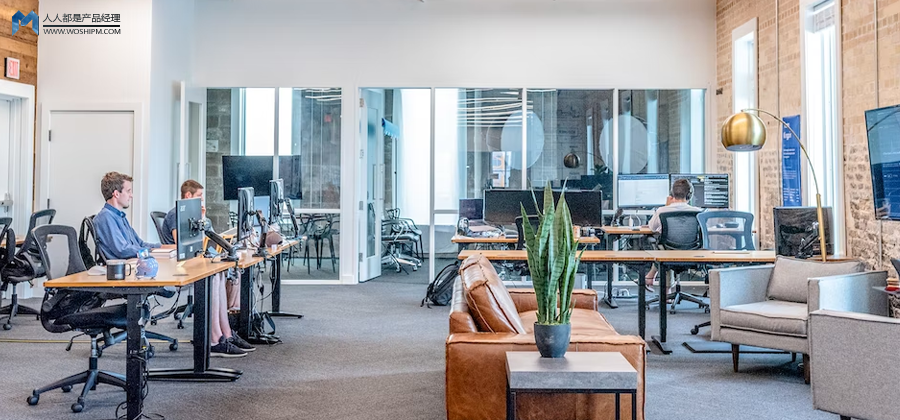
You are a GUI agent. You are given a task and a screenshot of the screen. Output one action in this format:
    pyautogui.click(x=<x>, y=<y>)
    Task: Click on the window
    This screenshot has height=420, width=900.
    Given the screenshot: What is the action you would take?
    pyautogui.click(x=258, y=127), pyautogui.click(x=412, y=136), pyautogui.click(x=740, y=90), pyautogui.click(x=828, y=92), pyautogui.click(x=694, y=150), pyautogui.click(x=653, y=121), pyautogui.click(x=627, y=118), pyautogui.click(x=606, y=136), pyautogui.click(x=588, y=149)